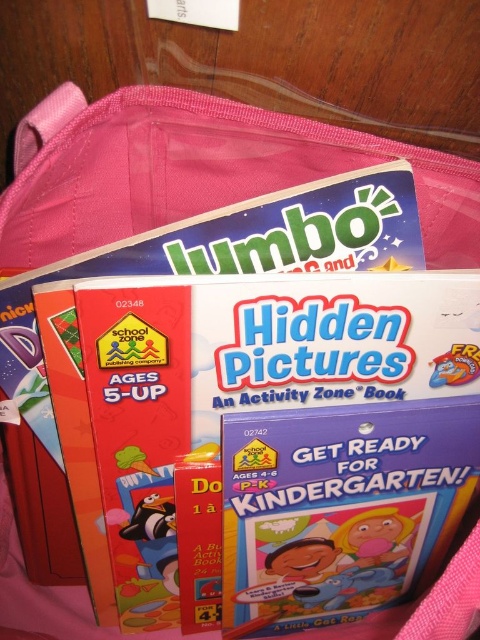
You are organizing a classroom and need to place a new book on the shelf. The existing books are arranged in a grid pattern with coordinates marked for each spot. Where should you place the matte pink book at center based on its 2D location?

The matte pink book at center should be placed at coordinates point (372,538) as specified in its 2D location.

You are a child trying to pack your lunch. You have a white paper lunch box at center and a matte plastic spoon at center in your bag. Which item is easier to reach without moving the other?

The white paper lunch box at center is easier to reach because it is in front of the matte plastic spoon at center, making it more accessible.

You are a teacher organizing a classroom. You have a shelf that can only hold items up to 10 cm in height. You see the matte pink book at center and the shiny metallic sticker at center. Which item can safely be placed on the shelf without exceeding the height limit?

The shiny metallic sticker at center can be safely placed on the shelf since it is shorter than the matte pink book at center, which is taller and would exceed the 10 cm height limit.